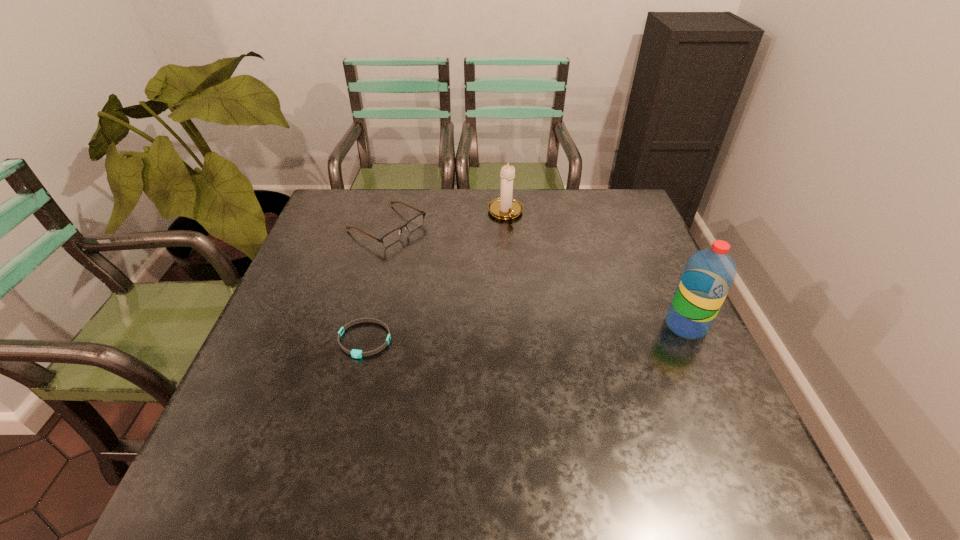
You are a GUI agent. You are given a task and a screenshot of the screen. Output one action in this format:
    pyautogui.click(x=<x>, y=<y>)
    Task: Click on the vacant space located on the handle side of the candle holder
    This screenshot has width=960, height=540.
    Given the screenshot: What is the action you would take?
    pyautogui.click(x=559, y=318)

In order to click on free location located on the handle side of the candle holder in this screenshot , I will do `click(531, 263)`.

Locate an element on the screen. free region located 0.190m on the handle side of the candle holder is located at coordinates (531, 263).

Where is `spectacles that is at the far edge`? The width and height of the screenshot is (960, 540). spectacles that is at the far edge is located at coordinates (394, 235).

The height and width of the screenshot is (540, 960). I want to click on candle holder positioned at the far edge, so click(505, 207).

In order to click on object positioned at the left edge in this screenshot , I will do `click(394, 235)`.

Find the location of a particular element. object present at the right edge is located at coordinates (709, 274).

What are the coordinates of `object that is at the far left corner` in the screenshot? It's located at (394, 235).

Locate an element on the screen. The image size is (960, 540). vacant area at the far edge of the desktop is located at coordinates (580, 226).

The height and width of the screenshot is (540, 960). Identify the location of vacant region at the near edge of the desktop. (379, 441).